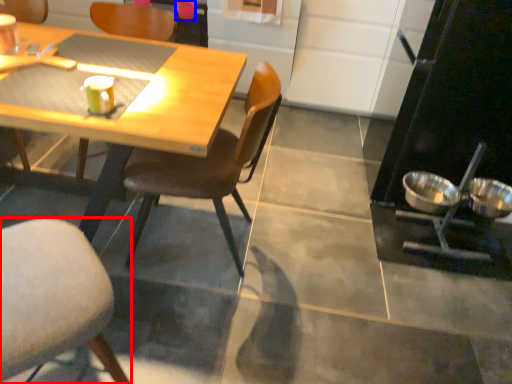
Question: Which of the following is the closest to the observer, chair (highlighted by a red box) or coffee cup (highlighted by a blue box)?

Choices:
 (A) chair
 (B) coffee cup

Answer: (A)